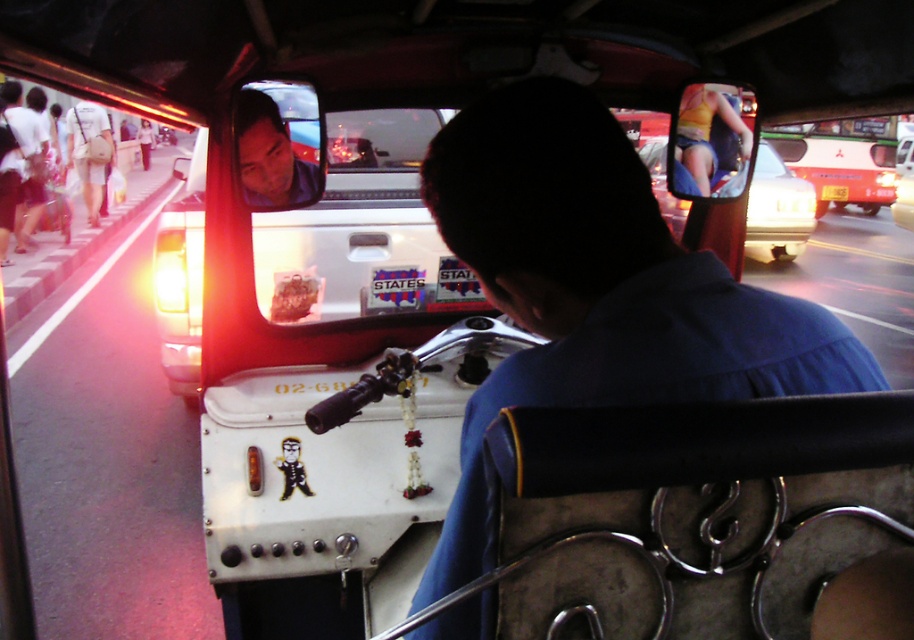
You are a passenger in the tricycle and notice two yellow items near the driver. The yellow fabric bikini at upper right and the yellow plastic license plate at center. Which of these two items is smaller in size?

The yellow fabric bikini at upper right is smaller in size compared to the yellow plastic license plate at center according to the description.

You are sitting in the driver seat of the tricycle and want to place a small sticker on the dashboard. You have two options for placement locations based on coordinates given as points. The first point is at coordinates point (254, 93) and the second is at point (80, 172). If you want to place the sticker closer to the front of the vehicle, which point should you choose?

Point (254, 93) is in front of point (80, 172), so you should choose point (254, 93) to place the sticker closer to the front of the vehicle.

You are a passenger in the tricycle and want to place your small phone on the dashboard. You see the matte plastic face at upper center and the white fabric bag at left. Which object is closer to the front of the tricycle?

The matte plastic face at upper center is below the white fabric bag at left, so the white fabric bag at left is closer to the front of the tricycle.